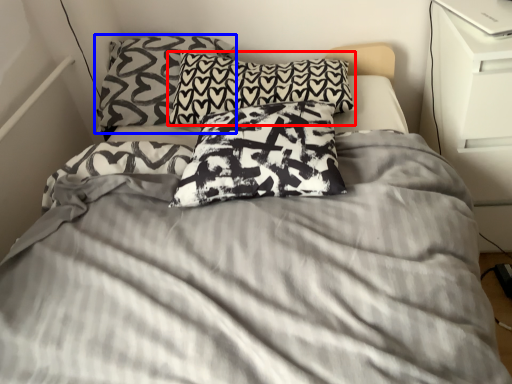
Question: Which object is closer to the camera taking this photo, pillow (highlighted by a red box) or pillow (highlighted by a blue box)?

Choices:
 (A) pillow
 (B) pillow

Answer: (A)